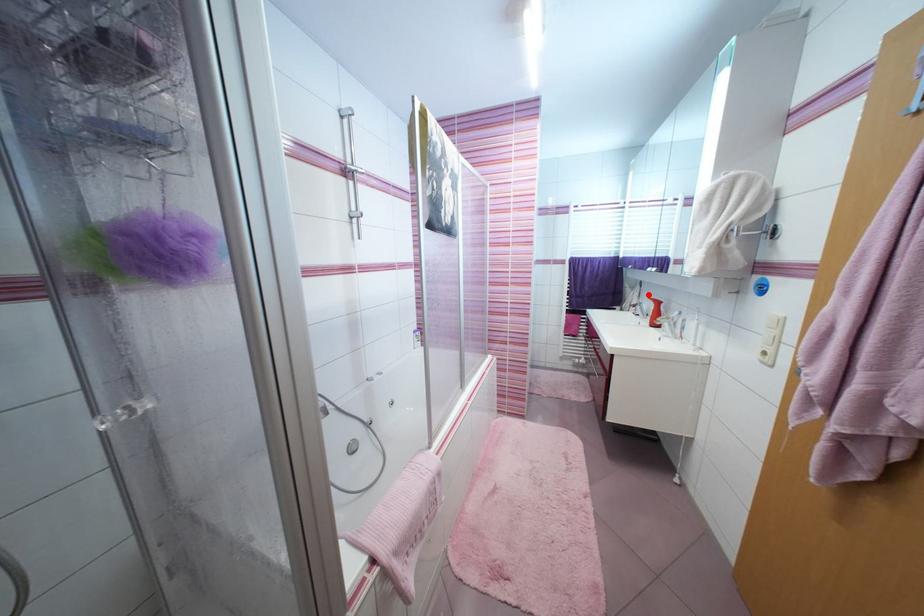
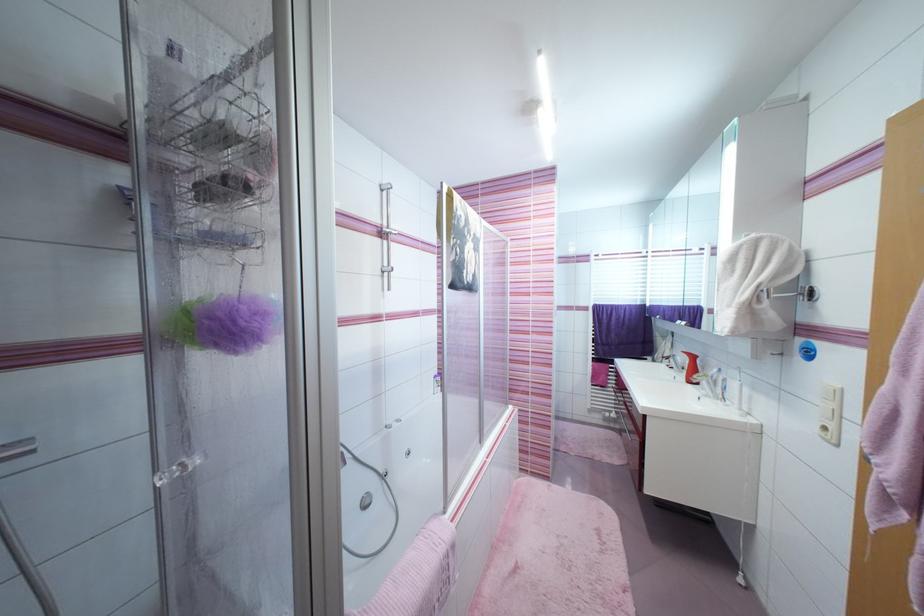
Locate, in the second image, the point that corresponds to the highlighted location in the first image.

(682, 345)